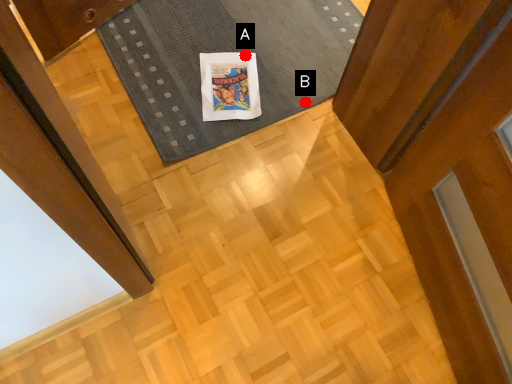
Question: Two points are circled on the image, labeled by A and B beside each circle. Which point is closer to the camera?

Choices:
 (A) A is closer
 (B) B is closer

Answer: (B)